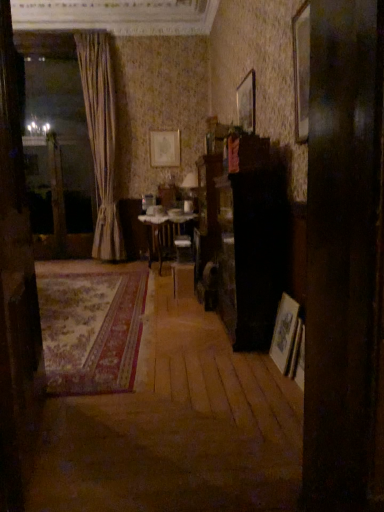
Question: Is wooden picture frame at upper right, which is the 2th picture frame from left to right, outside beige fabric curtain at left?

Choices:
 (A) no
 (B) yes

Answer: (B)

Question: Can you confirm if wooden picture frame at upper right, which is the second picture frame in bottom-to-top order, is positioned to the left of beige fabric curtain at left?

Choices:
 (A) yes
 (B) no

Answer: (B)

Question: Does wooden picture frame at upper right, positioned as the 2th picture frame in right-to-left order, have a lesser height compared to beige fabric curtain at left?

Choices:
 (A) yes
 (B) no

Answer: (A)

Question: From a real-world perspective, does wooden picture frame at upper right, which is counted as the 2th picture frame, starting from the top, sit lower than beige fabric curtain at left?

Choices:
 (A) yes
 (B) no

Answer: (B)

Question: From a real-world perspective, is wooden floor at center positioned above or below matte gold picture frame at upper center, which is the third picture frame from front to back?

Choices:
 (A) above
 (B) below

Answer: (B)

Question: Would you say wooden floor at center is to the left or to the right of matte gold picture frame at upper center, which is the 1th picture frame in back-to-front order, in the picture?

Choices:
 (A) right
 (B) left

Answer: (B)

Question: From the image's perspective, relative to matte gold picture frame at upper center, marked as the 1th picture frame in a top-to-bottom arrangement, is wooden floor at center above or below?

Choices:
 (A) below
 (B) above

Answer: (A)

Question: Does point (105, 480) appear closer or farther from the camera than point (175, 163)?

Choices:
 (A) closer
 (B) farther

Answer: (A)

Question: From the image's perspective, is wooden picture frame at upper right, positioned as the second picture frame in front-to-back order, above or below carpeted rug at center?

Choices:
 (A) below
 (B) above

Answer: (B)

Question: Is wooden picture frame at upper right, positioned as the 2th picture frame in back-to-front order, wider or thinner than carpeted rug at center?

Choices:
 (A) thin
 (B) wide

Answer: (A)

Question: Is wooden picture frame at upper right, positioned as the second picture frame in front-to-back order, in front of or behind carpeted rug at center in the image?

Choices:
 (A) front
 (B) behind

Answer: (B)

Question: Based on their sizes in the image, would you say wooden picture frame at upper right, which is counted as the 2th picture frame, starting from the top, is bigger or smaller than carpeted rug at center?

Choices:
 (A) big
 (B) small

Answer: (B)

Question: In terms of size, does wooden floor at center appear bigger or smaller than wooden picture frame at right, the 3th picture frame viewed from the left?

Choices:
 (A) big
 (B) small

Answer: (A)

Question: Considering the positions of wooden floor at center and wooden picture frame at right, the 3th picture frame viewed from the left, in the image, is wooden floor at center wider or thinner than wooden picture frame at right, the 3th picture frame viewed from the left,?

Choices:
 (A) thin
 (B) wide

Answer: (B)